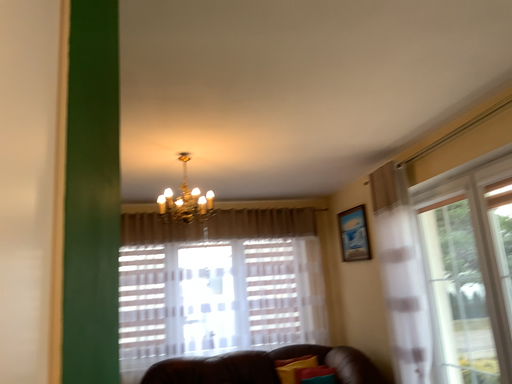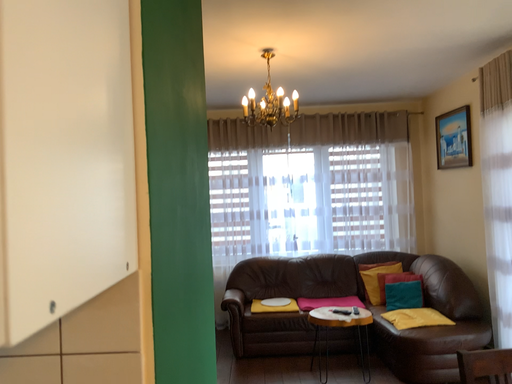
Question: Which way did the camera rotate in the video?

Choices:
 (A) rotated left
 (B) rotated right

Answer: (A)